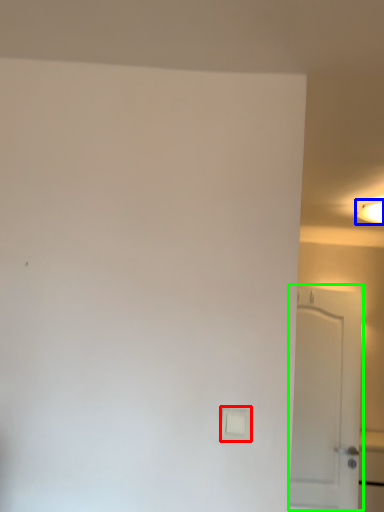
Question: Based on their relative distances, which object is farther from light switch (highlighted by a red box)? Choose from lighting (highlighted by a blue box) and door (highlighted by a green box).

Choices:
 (A) lighting
 (B) door

Answer: (A)